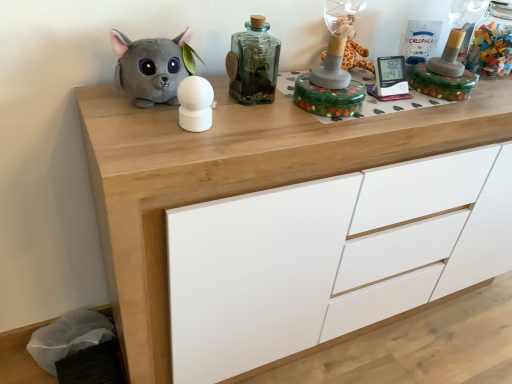
Image resolution: width=512 pixels, height=384 pixels. I want to click on vacant area that is in front of translucent glass bottle at center, the 1th bottle positioned from the front, so click(x=247, y=125).